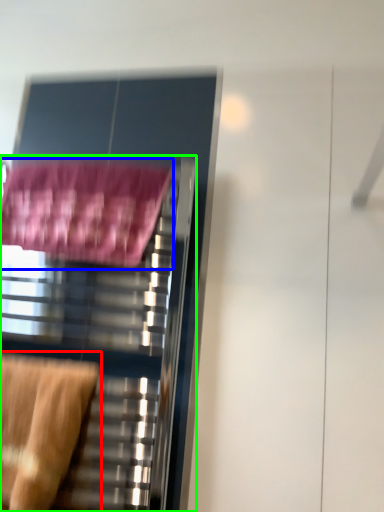
Question: Based on their relative distances, which object is farther from swivel chair (highlighted by a red box)? Choose from bath towel (highlighted by a blue box) and furniture (highlighted by a green box).

Choices:
 (A) bath towel
 (B) furniture

Answer: (A)